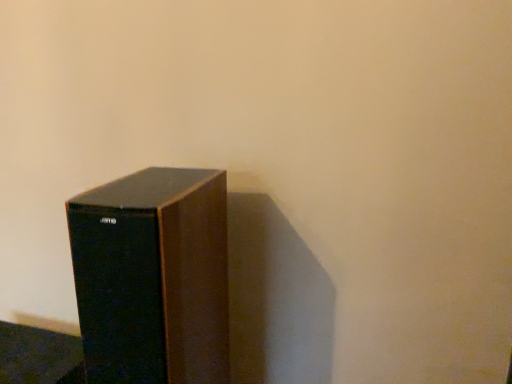
Describe the element at coordinates (39, 356) in the screenshot. I see `black matte speaker at lower left` at that location.

What is the approximate height of black matte speaker at lower left?

black matte speaker at lower left is 5.21 inches tall.

The width and height of the screenshot is (512, 384). I want to click on black matte speaker at lower left, so click(39, 356).

This screenshot has height=384, width=512. I want to click on black matte speaker at lower left, so click(x=39, y=356).